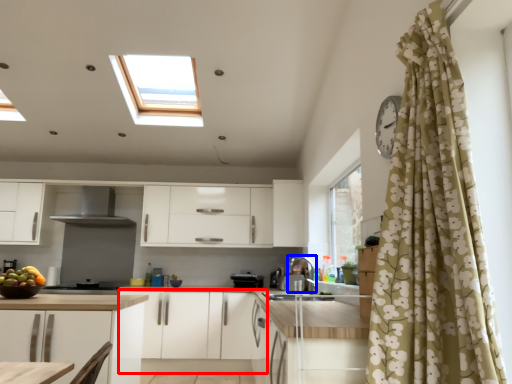
Question: Which of the following is the farthest to the observer, cabinetry (highlighted by a red box) or appliance (highlighted by a blue box)?

Choices:
 (A) cabinetry
 (B) appliance

Answer: (A)